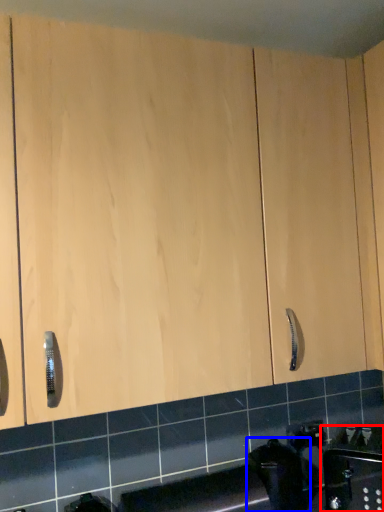
Question: Which of the following is the farthest to the observer, sink (highlighted by a red box) or appliance (highlighted by a blue box)?

Choices:
 (A) sink
 (B) appliance

Answer: (B)